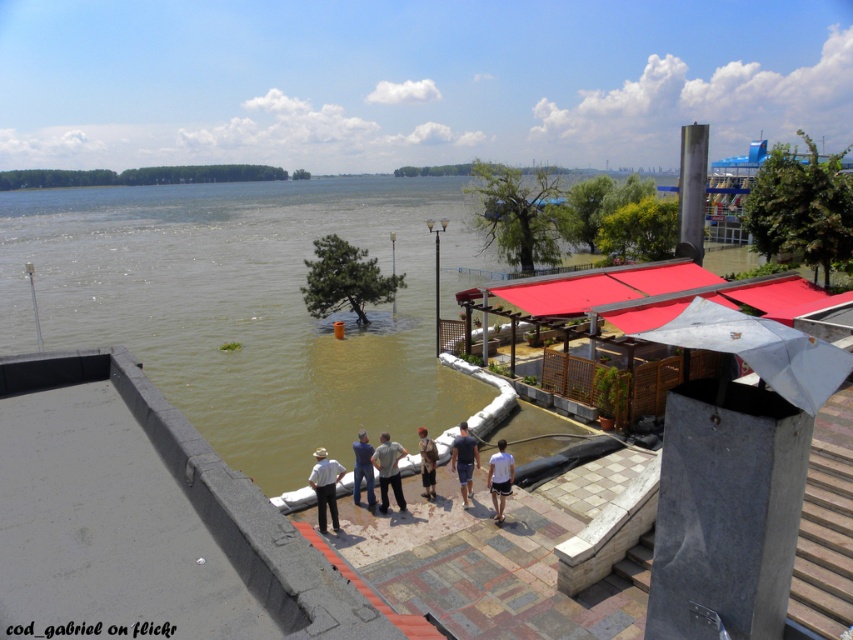
Question: Where is dark blue t-shirt at center located in relation to light brown leather pants at center in the image?

Choices:
 (A) below
 (B) above

Answer: (A)

Question: Which object appears farthest from the camera in this image?

Choices:
 (A) white matte shirt at center
 (B) light brown leather pants at center

Answer: (B)

Question: Which point appears farthest from the camera in this image?

Choices:
 (A) (386, 452)
 (B) (476, 445)
 (C) (367, 436)
 (D) (316, 458)

Answer: (C)

Question: Which object appears closest to the camera in this image?

Choices:
 (A) brown muddy water at center
 (B) light brown leather pants at center
 (C) white matte shirt at center

Answer: (C)

Question: Is dark blue t-shirt at center to the right of light brown leather pants at center from the viewer's perspective?

Choices:
 (A) no
 (B) yes

Answer: (B)

Question: Where is brown muddy water at center located in relation to light brown leather pants at center in the image?

Choices:
 (A) above
 (B) below

Answer: (A)